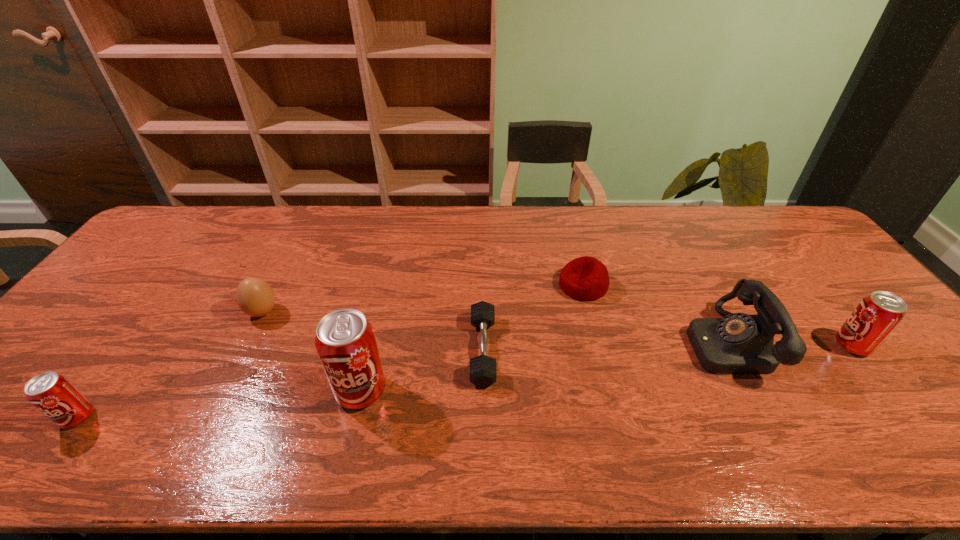
Identify the location of the shortest soda. (54, 395).

Find the location of a particular element. Image resolution: width=960 pixels, height=540 pixels. the leftmost soda is located at coordinates (54, 395).

In order to click on the second soda from right to left in this screenshot , I will do `click(345, 341)`.

Image resolution: width=960 pixels, height=540 pixels. I want to click on the third object from left to right, so click(x=345, y=341).

Find the location of a particular element. This screenshot has width=960, height=540. the second tallest soda is located at coordinates (877, 315).

Find the location of a particular element. This screenshot has width=960, height=540. the rightmost object is located at coordinates (877, 315).

Identify the location of the second shortest object. (586, 278).

Locate an element on the screen. The width and height of the screenshot is (960, 540). the third object from right to left is located at coordinates (586, 278).

The width and height of the screenshot is (960, 540). What are the coordinates of `the sixth object from right to left` in the screenshot? It's located at (255, 297).

Identify the location of the shortest object. The image size is (960, 540). tap(483, 372).